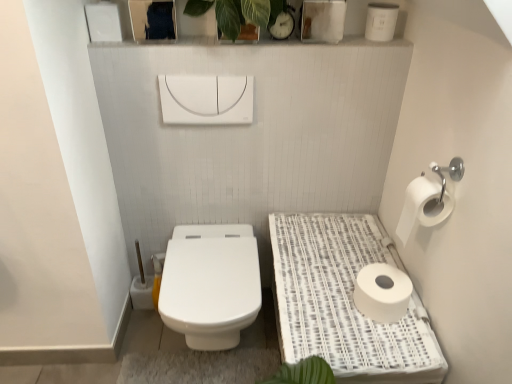
Question: Does white matte toilet paper at right, marked as the first toilet paper in a top-to-bottom arrangement, appear on the right side of white matte toilet paper at lower right, acting as the first toilet paper starting from the bottom?

Choices:
 (A) no
 (B) yes

Answer: (B)

Question: Is white matte toilet paper at right, marked as the first toilet paper in a top-to-bottom arrangement, positioned with its back to white matte toilet paper at lower right, acting as the first toilet paper starting from the bottom?

Choices:
 (A) no
 (B) yes

Answer: (A)

Question: Can we say white matte toilet paper at right, which is the 2th toilet paper in bottom-to-top order, lies outside white matte toilet paper at lower right, placed as the 2th toilet paper when sorted from top to bottom?

Choices:
 (A) yes
 (B) no

Answer: (A)

Question: From a real-world perspective, is white matte toilet paper at right, marked as the first toilet paper in a top-to-bottom arrangement, on white matte toilet paper at lower right, placed as the 2th toilet paper when sorted from top to bottom?

Choices:
 (A) yes
 (B) no

Answer: (A)

Question: Is white matte toilet paper at right, marked as the first toilet paper in a top-to-bottom arrangement, at the left side of white matte toilet paper at lower right, acting as the first toilet paper starting from the bottom?

Choices:
 (A) no
 (B) yes

Answer: (A)

Question: In the image, is white woven tray at right positioned in front of or behind white glossy toilet at center?

Choices:
 (A) behind
 (B) front

Answer: (B)

Question: Is white woven tray at right inside or outside of white glossy toilet at center?

Choices:
 (A) inside
 (B) outside

Answer: (B)

Question: From a real-world perspective, relative to white glossy toilet at center, is white woven tray at right vertically above or below?

Choices:
 (A) above
 (B) below

Answer: (A)

Question: In terms of size, does white woven tray at right appear bigger or smaller than white glossy toilet at center?

Choices:
 (A) big
 (B) small

Answer: (A)

Question: Do you think white woven tray at right is within white matte toilet paper at lower right, placed as the 2th toilet paper when sorted from top to bottom, or outside of it?

Choices:
 (A) inside
 (B) outside

Answer: (B)

Question: Based on their positions, is white woven tray at right located to the left or right of white matte toilet paper at lower right, placed as the 2th toilet paper when sorted from top to bottom?

Choices:
 (A) right
 (B) left

Answer: (B)

Question: From the image's perspective, is white woven tray at right positioned above or below white matte toilet paper at lower right, placed as the 2th toilet paper when sorted from top to bottom?

Choices:
 (A) below
 (B) above

Answer: (A)

Question: Is white woven tray at right wider or thinner than white matte toilet paper at lower right, acting as the first toilet paper starting from the bottom?

Choices:
 (A) wide
 (B) thin

Answer: (A)

Question: In the image, is white matte toilet paper at lower right, placed as the 2th toilet paper when sorted from top to bottom, positioned in front of or behind white matte toilet paper at right, which is the 2th toilet paper in bottom-to-top order?

Choices:
 (A) behind
 (B) front

Answer: (A)

Question: From a real-world perspective, relative to white matte toilet paper at right, which is the 2th toilet paper in bottom-to-top order, is white matte toilet paper at lower right, placed as the 2th toilet paper when sorted from top to bottom, vertically above or below?

Choices:
 (A) above
 (B) below

Answer: (B)